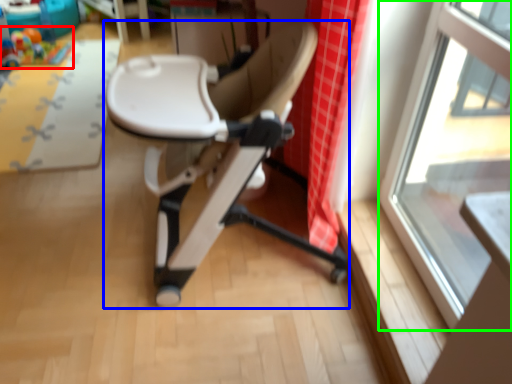
Question: Considering the real-world distances, which object is closest to toy (highlighted by a red box)? chair (highlighted by a blue box) or window (highlighted by a green box).

Choices:
 (A) chair
 (B) window

Answer: (A)